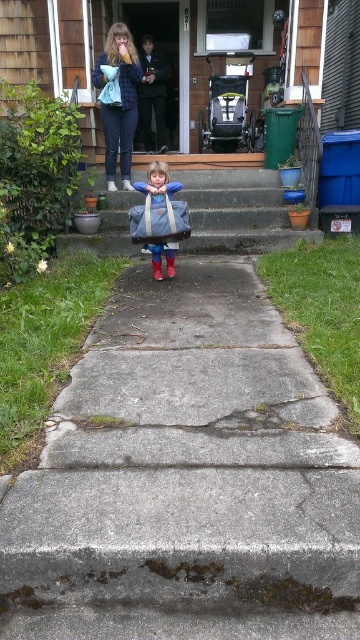
Does point (83, 481) come closer to viewer compared to point (114, 164)?

That is True.

This screenshot has height=640, width=360. Describe the element at coordinates (186, 477) in the screenshot. I see `concrete steps at center` at that location.

Image resolution: width=360 pixels, height=640 pixels. Identify the location of concrete steps at center. (186, 477).

This screenshot has width=360, height=640. What are the coordinates of `concrete steps at center` in the screenshot? It's located at coord(186,477).

Does concrete steps at center have a greater width compared to matte blue backpack at center?

Yes, concrete steps at center is wider than matte blue backpack at center.

Who is more forward, (105, 484) or (177, 188)?

Positioned in front is point (105, 484).

You are a GUI agent. You are given a task and a screenshot of the screen. Output one action in this format:
    pyautogui.click(x=<x>, y=<y>)
    Task: Click on the concrete steps at center
    
    Given the screenshot: What is the action you would take?
    pyautogui.click(x=186, y=477)

Who is higher up, concrete stairs at center or matte blue jacket at upper center?

matte blue jacket at upper center is above.

Does concrete stairs at center have a greater height compared to matte blue jacket at upper center?

No, concrete stairs at center is not taller than matte blue jacket at upper center.

At what (x,y) coordinates should I click in order to perform the action: click on concrete stairs at center. Please return your answer as a coordinate pair (x, y). This screenshot has width=360, height=640. Looking at the image, I should click on (237, 211).

Where is `concrete stairs at center`? concrete stairs at center is located at coordinates (237, 211).